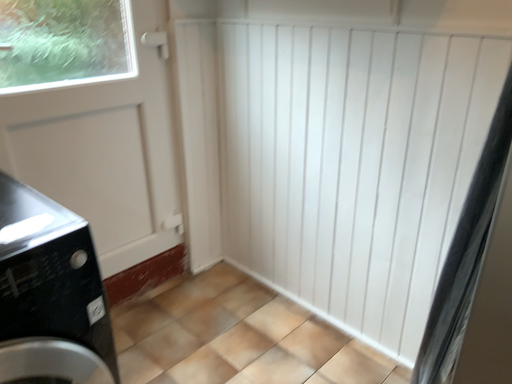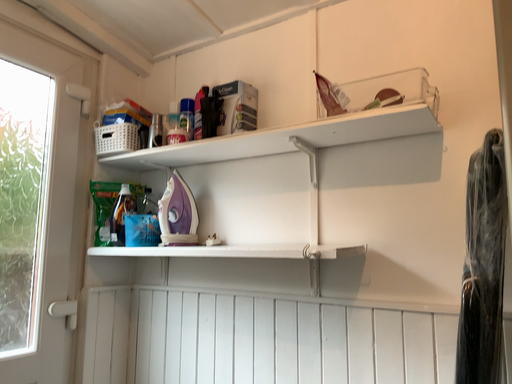
Question: Which way did the camera rotate in the video?

Choices:
 (A) rotated left
 (B) rotated right

Answer: (B)